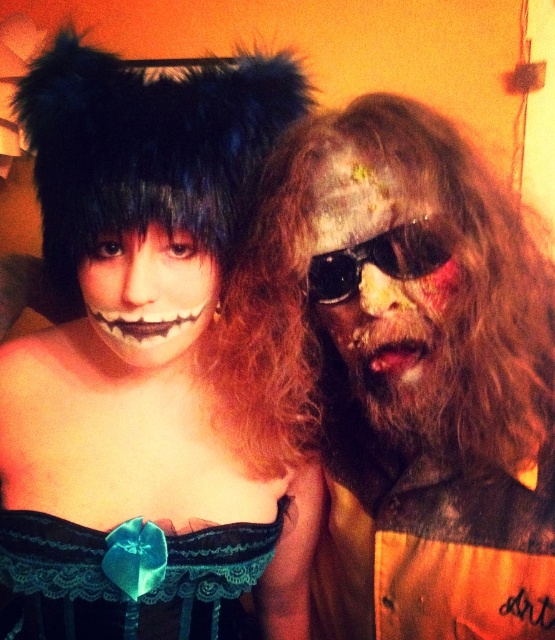
Who is higher up, black fur hat at upper left or black plastic sunglasses at right?

Positioned higher is black plastic sunglasses at right.

Can you confirm if black fur hat at upper left is shorter than black plastic sunglasses at right?

Incorrect, black fur hat at upper left's height does not fall short of black plastic sunglasses at right's.

Describe the element at coordinates (148, 368) in the screenshot. I see `black fur hat at upper left` at that location.

You are a GUI agent. You are given a task and a screenshot of the screen. Output one action in this format:
    pyautogui.click(x=<x>, y=<y>)
    Task: Click on the black fur hat at upper left
    This screenshot has width=555, height=640.
    Given the screenshot: What is the action you would take?
    pyautogui.click(x=148, y=368)

Does black fur hat at upper left come behind lace fabric dress at center?

No, black fur hat at upper left is in front of lace fabric dress at center.

Image resolution: width=555 pixels, height=640 pixels. I want to click on black fur hat at upper left, so click(x=148, y=368).

Can you confirm if white matte face paint at center is smaller than black plastic sunglasses at right?

No.

Which is below, white matte face paint at center or black plastic sunglasses at right?

white matte face paint at center is lower down.

Between point (165, 282) and point (395, 244), which one is positioned behind?

The point (165, 282) is behind.

Identify the location of white matte face paint at center. click(148, 292).